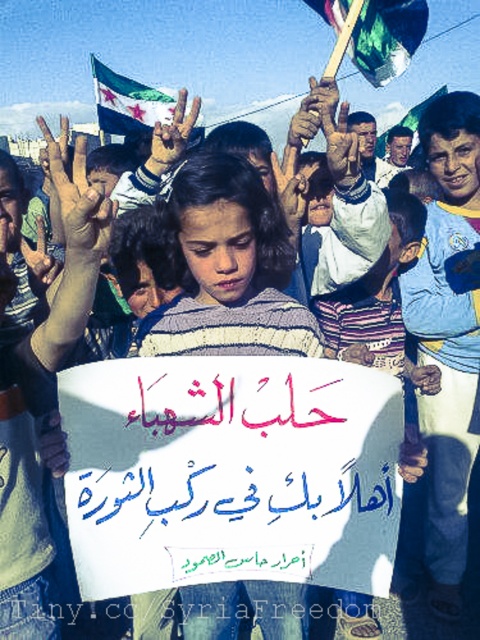
Question: Does white paper placard at center have a greater width compared to striped sweater at center?

Choices:
 (A) no
 (B) yes

Answer: (B)

Question: Does striped sweater at center appear on the right side of green glossy flag at upper center?

Choices:
 (A) yes
 (B) no

Answer: (B)

Question: Which point is farther from the camera taking this photo?

Choices:
 (A) (282, 618)
 (B) (326, 476)
 (C) (386, 29)
 (D) (63, 170)

Answer: (C)

Question: Among these objects, which one is nearest to the camera?

Choices:
 (A) striped sweater at center
 (B) green glossy flag at upper center

Answer: (A)

Question: Which object is closer to the camera taking this photo?

Choices:
 (A) green fabric flag at upper center
 (B) white paper placard at center

Answer: (B)

Question: Considering the relative positions of white paper placard at center and brown leather hand at center in the image provided, where is white paper placard at center located with respect to brown leather hand at center?

Choices:
 (A) above
 (B) below

Answer: (B)